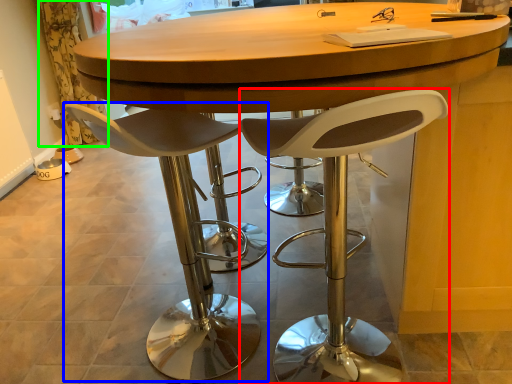
Question: Which is farther away from chair (highlighted by a red box)? chair (highlighted by a blue box) or curtain (highlighted by a green box)?

Choices:
 (A) chair
 (B) curtain

Answer: (B)